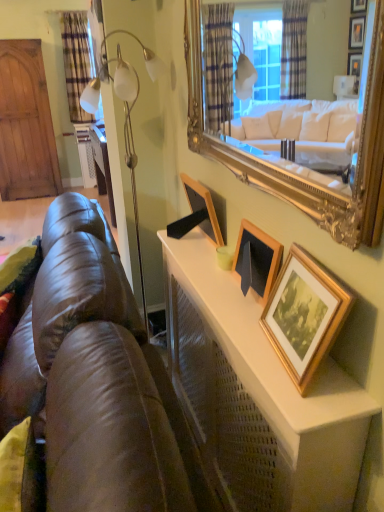
Question: Looking at their shapes, would you say gold wooden picture frame at upper right, the third picture frame positioned from the left, is wider or thinner than wooden picture frame at center, the 2th picture frame viewed from the left?

Choices:
 (A) wide
 (B) thin

Answer: (B)

Question: From the image's perspective, is gold wooden picture frame at upper right, which is the third picture frame from back to front, located above or below wooden picture frame at center, marked as the 2th picture frame in a right-to-left arrangement?

Choices:
 (A) below
 (B) above

Answer: (A)

Question: Considering the real-world distances, which object is farthest from the brown leather couch at lower left?

Choices:
 (A) wooden picture frame at center, the 2th picture frame viewed from the left
 (B) wooden picture frame at upper center, which is counted as the third picture frame, starting from the front
 (C) gold wooden picture frame at upper right, the third picture frame positioned from the left
 (D) gold ornate mirror at upper center
 (E) plaid fabric curtain at upper left

Answer: (E)

Question: Which object is the farthest from the brown leather couch at lower left?

Choices:
 (A) wooden picture frame at upper center, which is the first picture frame in back-to-front order
 (B) wooden picture frame at center, which is the second picture frame in front-to-back order
 (C) gold ornate mirror at upper center
 (D) plaid fabric curtain at upper left
 (E) gold wooden picture frame at upper right, the first picture frame in the right-to-left sequence

Answer: (D)